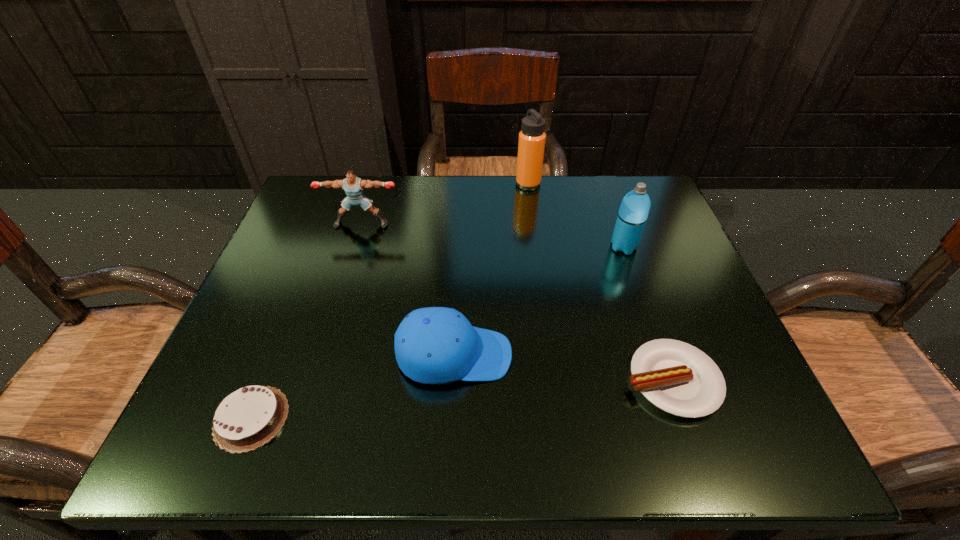
I want to click on free space located on the front of the farther thermos bottle, so click(534, 222).

You are a GUI agent. You are given a task and a screenshot of the screen. Output one action in this format:
    pyautogui.click(x=<x>, y=<y>)
    Task: Click on the free spot located 0.080m on the front of the right thermos bottle
    This screenshot has height=540, width=960.
    Given the screenshot: What is the action you would take?
    pyautogui.click(x=636, y=282)

Identify the location of vacant area situated on the front-facing side of the puncher. The height and width of the screenshot is (540, 960). (346, 275).

I want to click on free space located 0.170m on the front-facing side of the third shortest object, so click(x=609, y=355).

Identify the location of blank area located 0.200m on the back of the sausage. The height and width of the screenshot is (540, 960). (632, 267).

The height and width of the screenshot is (540, 960). I want to click on free spot located 0.400m on the back of the chocolate cake, so click(324, 233).

Identify the location of thermos bottle at the far edge. (531, 144).

Identify the location of puncher that is at the far edge. The width and height of the screenshot is (960, 540). (353, 186).

This screenshot has height=540, width=960. Identify the location of sausage located at the near edge. (680, 379).

Locate an element on the screen. The width and height of the screenshot is (960, 540). chocolate cake located at the near edge is located at coordinates (246, 419).